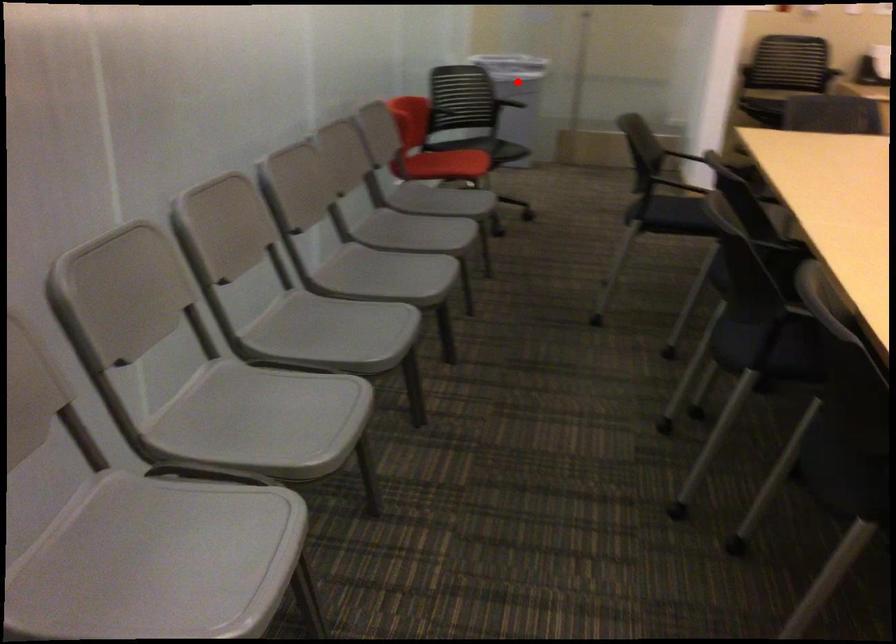
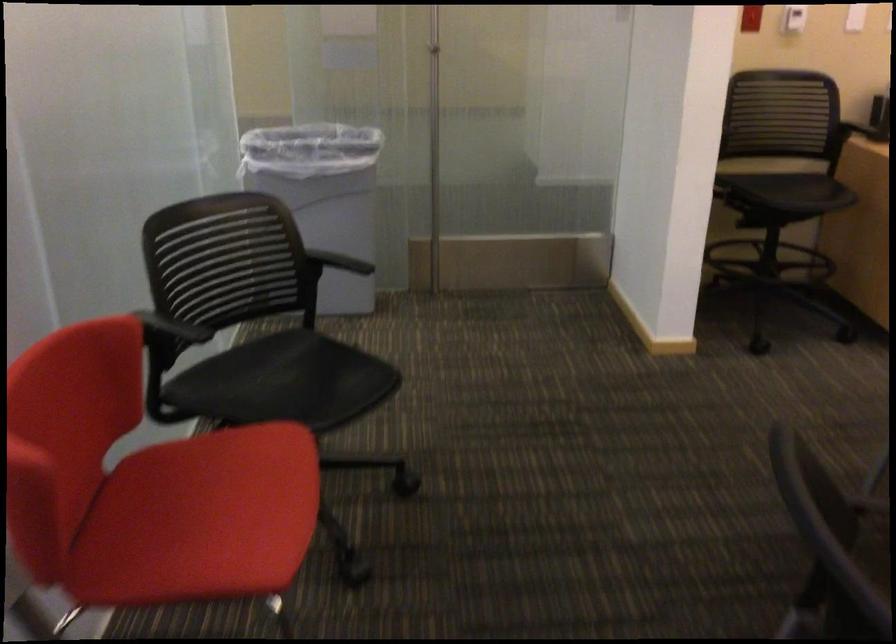
Question: I am providing you with two images of the same scene from different viewpoints. A red point is shown in image1. For the corresponding object point in image2, is it positioned nearer or farther from the camera?

Choices:
 (A) Nearer
 (B) Farther

Answer: (A)